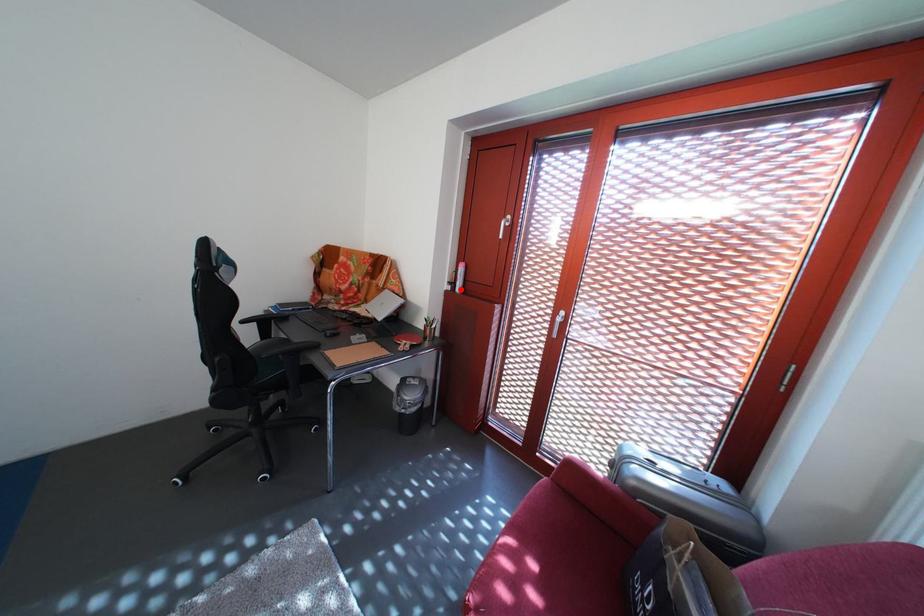
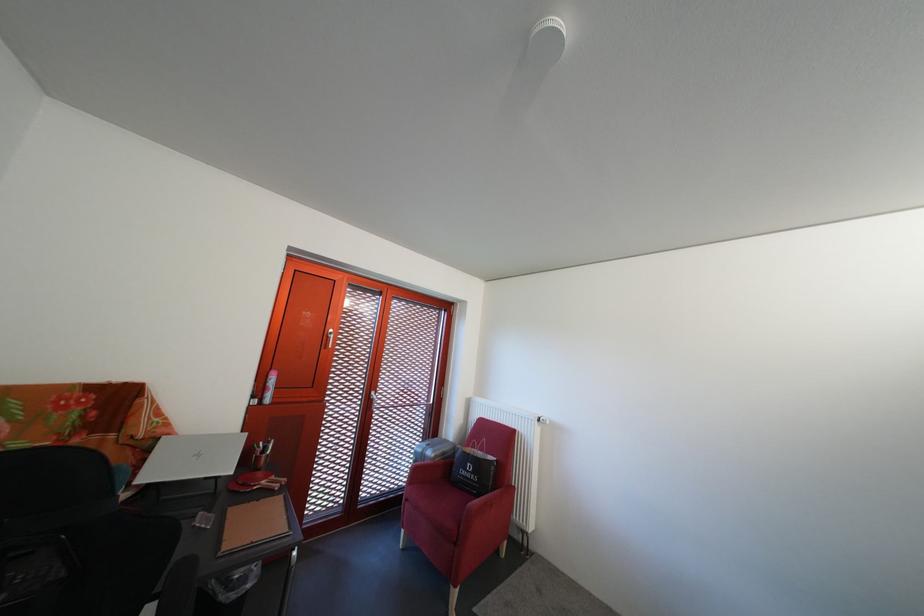
Where in the second image is the point corresponding to the highlighted location from the first image?

(263, 403)